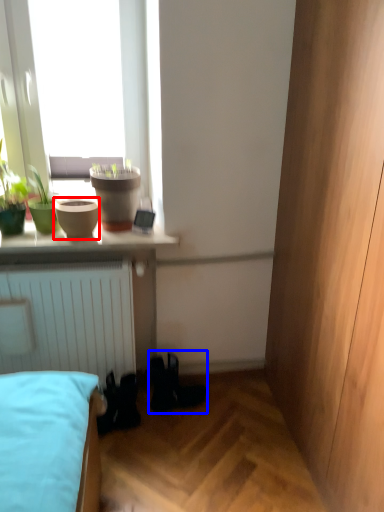
Question: Which object appears farthest to the camera in this image, flowerpot (highlighted by a red box) or shoe (highlighted by a blue box)?

Choices:
 (A) flowerpot
 (B) shoe

Answer: (B)